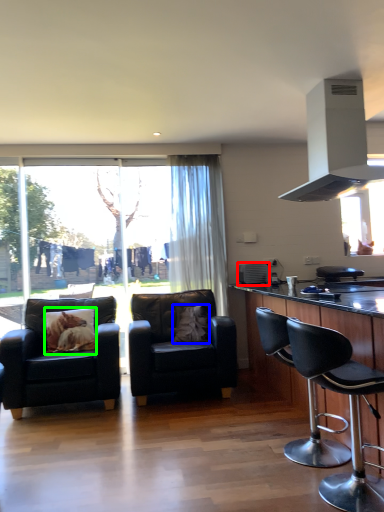
Question: Which object is positioned closest to appliance (highlighted by a red box)? Select from pillow (highlighted by a blue box) and pillow (highlighted by a green box).

Choices:
 (A) pillow
 (B) pillow

Answer: (A)